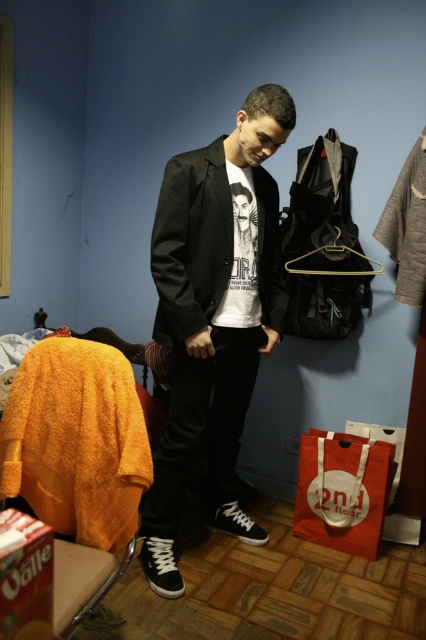
Question: Which of the following is the farthest from the observer?

Choices:
 (A) (0, 467)
 (B) (290, 125)

Answer: (B)

Question: Is orange fuzzy sweater at left bigger than matte black jacket at center?

Choices:
 (A) yes
 (B) no

Answer: (B)

Question: Which is farther from the matte black sneakers at lower left?

Choices:
 (A) matte black jacket at center
 (B) orange fuzzy sweater at left

Answer: (B)

Question: Does orange fuzzy sweater at left come behind matte black jacket at center?

Choices:
 (A) no
 (B) yes

Answer: (A)

Question: Which object is closer to the camera taking this photo?

Choices:
 (A) matte black jacket at center
 (B) matte black sneakers at lower left
 (C) orange fuzzy sweater at left

Answer: (C)

Question: Can you confirm if matte black sneakers at lower left is positioned above orange fuzzy sweater at left?

Choices:
 (A) yes
 (B) no

Answer: (A)